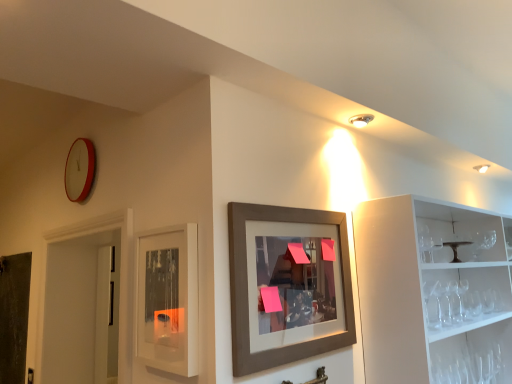
What do you see at coordinates (456, 248) in the screenshot?
I see `metallic dark brown cake stand at right` at bounding box center [456, 248].

The image size is (512, 384). Find the location of `metallic silver faucet at lower center`. metallic silver faucet at lower center is located at coordinates (319, 377).

What is the approximate width of brown wooden picture frame at center?

brown wooden picture frame at center is 1.62 inches in width.

What do you see at coordinates (79, 170) in the screenshot?
I see `matte red clock at upper left` at bounding box center [79, 170].

Identify the location of metallic dark brown cake stand at right. (456, 248).

Is metallic silver faucet at lower center oriented away from brown wooden picture frame at center?

No.

Which is behind, metallic silver faucet at lower center or brown wooden picture frame at center?

metallic silver faucet at lower center is more distant.

Does point (319, 379) come in front of point (234, 355)?

No, it is not.

From the picture: Between metallic silver faucet at lower center and brown wooden picture frame at center, which one appears on the right side from the viewer's perspective?

From the viewer's perspective, metallic silver faucet at lower center appears more on the right side.

Does brown wooden picture frame at center turn towards matte red clock at upper left?

No, brown wooden picture frame at center is not turned towards matte red clock at upper left.

Considering the positions of objects brown wooden picture frame at center and matte red clock at upper left in the image provided, who is behind, brown wooden picture frame at center or matte red clock at upper left?

matte red clock at upper left is further away from the camera.

Considering the positions of point (326, 351) and point (88, 170), is point (326, 351) closer or farther from the camera than point (88, 170)?

Point (326, 351) is positioned closer to the camera compared to point (88, 170).

Looking at this image, from the image's perspective, is brown wooden picture frame at center located above or below matte red clock at upper left?

brown wooden picture frame at center is below matte red clock at upper left.

Would you say metallic dark brown cake stand at right is part of matte glass cabinet at center's contents?

No, matte glass cabinet at center does not contain metallic dark brown cake stand at right.

From the image's perspective, is matte glass cabinet at center positioned above or below metallic dark brown cake stand at right?

matte glass cabinet at center is situated lower than metallic dark brown cake stand at right in the image.

Looking at this image, which of these two, matte glass cabinet at center or metallic dark brown cake stand at right, is wider?

metallic dark brown cake stand at right is wider.

At what (x,y) coordinates should I click in order to perform the action: click on picture frame lying above the dark gray matte door at left (from the image's perspective). Please return your answer as a coordinate pair (x, y). Looking at the image, I should click on (287, 285).

Could you tell me if dark gray matte door at left is facing brown wooden picture frame at center?

No, dark gray matte door at left is not facing towards brown wooden picture frame at center.

From the image's perspective, is dark gray matte door at left beneath brown wooden picture frame at center?

Yes.

Which of these two, dark gray matte door at left or brown wooden picture frame at center, stands taller?

With more height is dark gray matte door at left.

Looking at this image, is metallic dark brown cake stand at right not inside brown wooden picture frame at center?

Indeed, metallic dark brown cake stand at right is completely outside brown wooden picture frame at center.

Looking at this image, does metallic dark brown cake stand at right have a larger size compared to brown wooden picture frame at center?

Actually, metallic dark brown cake stand at right might be smaller than brown wooden picture frame at center.

What's the angular difference between metallic dark brown cake stand at right and brown wooden picture frame at center's facing directions?

The angle between the facing direction of metallic dark brown cake stand at right and the facing direction of brown wooden picture frame at center is 2.13 degrees.

From the image's perspective, is metallic dark brown cake stand at right beneath brown wooden picture frame at center?

No, from the image's perspective, metallic dark brown cake stand at right is not below brown wooden picture frame at center.

Is metallic dark brown cake stand at right not inside metallic silver faucet at lower center?

metallic dark brown cake stand at right is positioned outside metallic silver faucet at lower center.

Which of these two, metallic dark brown cake stand at right or metallic silver faucet at lower center, stands taller?

metallic silver faucet at lower center.

Between metallic dark brown cake stand at right and metallic silver faucet at lower center, which one has larger width?

metallic dark brown cake stand at right.

In the image, there is a metallic silver faucet at lower center. Identify the location of table above it (from the image's perspective). The height and width of the screenshot is (384, 512). (456, 248).

Considering the relative sizes of brown wooden picture frame at center and dark gray matte door at left in the image provided, is brown wooden picture frame at center smaller than dark gray matte door at left?

Indeed, brown wooden picture frame at center has a smaller size compared to dark gray matte door at left.

Which is closer to the camera, [352,305] or [6,297]?

Point [352,305].

Which is behind, brown wooden picture frame at center or dark gray matte door at left?

dark gray matte door at left is further away from the camera.

Find the location of a particular element. This screenshot has width=512, height=384. picture frame above the metallic silver faucet at lower center (from the image's perspective) is located at coordinates (287, 285).

Locate an element on the screen. The image size is (512, 384). clock behind the brown wooden picture frame at center is located at coordinates (79, 170).

From the image, which object appears to be farther from matte red clock at upper left, brown wooden picture frame at center or dark gray matte door at left?

Based on the image, brown wooden picture frame at center appears to be further to matte red clock at upper left.

Which object lies nearer to the anchor point dark gray matte door at left, metallic dark brown cake stand at right or metallic silver faucet at lower center?

metallic silver faucet at lower center.

When comparing their distances from matte glass cabinet at center, does brown wooden picture frame at center or dark gray matte door at left seem closer?

Among the two, brown wooden picture frame at center is located nearer to matte glass cabinet at center.

Looking at the image, which one is located closer to metallic dark brown cake stand at right, metallic silver faucet at lower center or matte glass cabinet at center?

metallic silver faucet at lower center lies closer to metallic dark brown cake stand at right than the other object.

Which object lies nearer to the anchor point brown wooden picture frame at center, metallic silver faucet at lower center or metallic dark brown cake stand at right?

metallic silver faucet at lower center is positioned closer to the anchor brown wooden picture frame at center.

Which object lies further to the anchor point matte glass cabinet at center, metallic silver faucet at lower center or dark gray matte door at left?

dark gray matte door at left is positioned further to the anchor matte glass cabinet at center.

Considering their positions, is metallic silver faucet at lower center positioned further to dark gray matte door at left than brown wooden picture frame at center?

The object further to dark gray matte door at left is metallic silver faucet at lower center.

Based on their spatial positions, is matte glass cabinet at center or brown wooden picture frame at center further from matte red clock at upper left?

Based on the image, brown wooden picture frame at center appears to be further to matte red clock at upper left.

Image resolution: width=512 pixels, height=384 pixels. Identify the location of clock located between dark gray matte door at left and metallic dark brown cake stand at right in the left-right direction. (79, 170).

The width and height of the screenshot is (512, 384). I want to click on picture frame between dark gray matte door at left and metallic silver faucet at lower center, so click(x=287, y=285).

Locate an element on the screen. clock situated between dark gray matte door at left and metallic silver faucet at lower center from left to right is located at coordinates (79, 170).

Find the location of `faucet located between brown wooden picture frame at center and metallic dark brown cake stand at right in the left-right direction`. faucet located between brown wooden picture frame at center and metallic dark brown cake stand at right in the left-right direction is located at coordinates (319, 377).